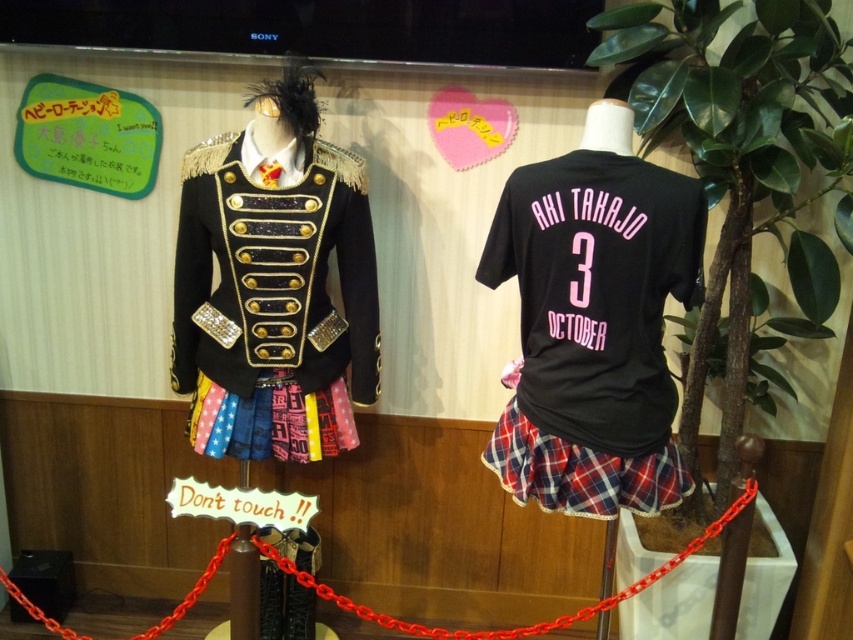
Question: Which point is closer to the camera taking this photo?

Choices:
 (A) (357, 365)
 (B) (305, 445)
 (C) (543, 429)

Answer: (C)

Question: From the image, what is the correct spatial relationship of shiny black jacket at center in relation to colorful plaid skirt at center?

Choices:
 (A) right
 (B) left

Answer: (A)

Question: Which of the following is the farthest from the observer?

Choices:
 (A) black jersey at center
 (B) colorful plaid skirt at center
 (C) plaid fabric skirt at center

Answer: (B)

Question: From the image, what is the correct spatial relationship of shiny black jacket at center in relation to plaid fabric skirt at center?

Choices:
 (A) above
 (B) below

Answer: (A)

Question: Considering the relative positions of shiny black jacket at center and plaid fabric skirt at center in the image provided, where is shiny black jacket at center located with respect to plaid fabric skirt at center?

Choices:
 (A) right
 (B) left

Answer: (B)

Question: Among these objects, which one is nearest to the camera?

Choices:
 (A) black jersey at center
 (B) shiny black jacket at center
 (C) colorful plaid skirt at center
 (D) plaid fabric skirt at center

Answer: (A)